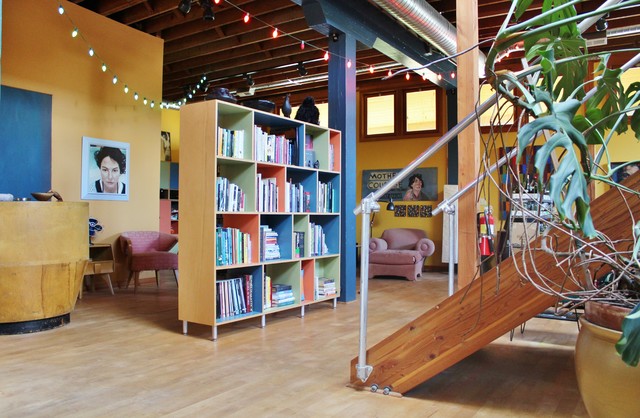
Locate an element on the screen. chairs is located at coordinates (136, 238), (400, 245).